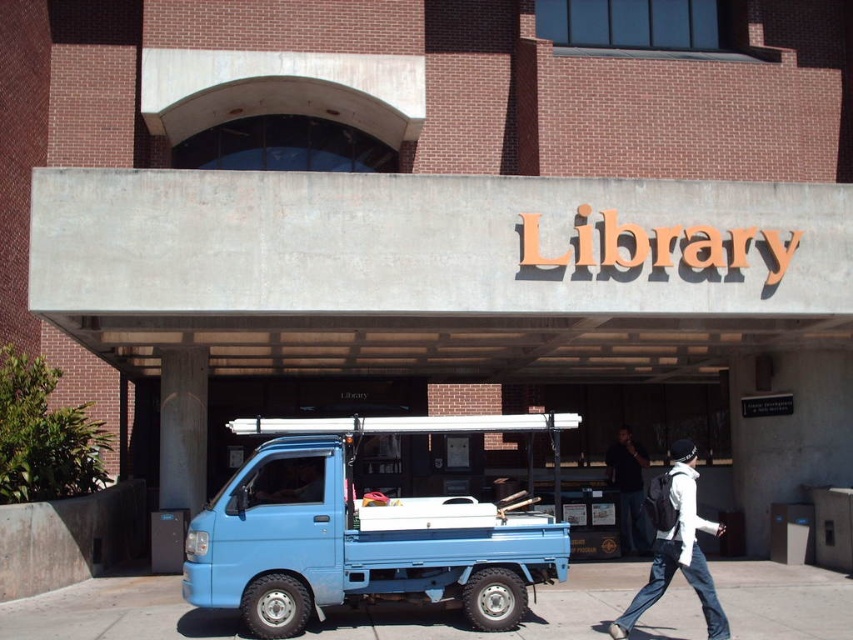
Question: Is blue matte truck at lower left wider than white matte jacket at center?

Choices:
 (A) yes
 (B) no

Answer: (A)

Question: Which of the following is the farthest from the observer?

Choices:
 (A) dark blue jeans at lower right
 (B) blue concrete pavement at lower center

Answer: (A)

Question: Can you confirm if white matte jacket at center is wider than dark blue jeans at lower right?

Choices:
 (A) no
 (B) yes

Answer: (A)

Question: Which of the following is the farthest from the observer?

Choices:
 (A) (563, 572)
 (B) (618, 508)
 (C) (64, 625)
 (D) (703, 614)

Answer: (B)

Question: Which point is farther from the camera taking this photo?

Choices:
 (A) (650, 577)
 (B) (624, 512)
 (C) (614, 586)

Answer: (B)

Question: Can you confirm if blue concrete pavement at lower center is positioned below dark blue jeans at lower right?

Choices:
 (A) yes
 (B) no

Answer: (A)